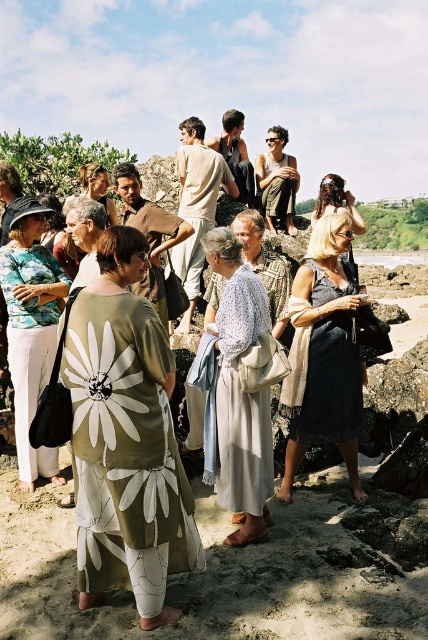
Question: Observing the image, what is the correct spatial positioning of dark gray dress at center in reference to matte brown robe at center?

Choices:
 (A) above
 (B) below

Answer: (B)

Question: Does matte green dress at center come behind blonde hair at center?

Choices:
 (A) no
 (B) yes

Answer: (A)

Question: Which is farther from the green floral dress at center?

Choices:
 (A) matte olive green dress at center
 (B) green floral robe at center
 (C) dark gray dress at center

Answer: (A)

Question: Can you confirm if green floral robe at center is positioned below matte brown robe at center?

Choices:
 (A) no
 (B) yes

Answer: (B)

Question: Which point is closer to the camera taking this photo?

Choices:
 (A) (339, 180)
 (B) (104, 208)
 (C) (249, 196)

Answer: (B)

Question: Which object appears closest to the camera in this image?

Choices:
 (A) light beige cotton robe at center
 (B) green floral dress at center

Answer: (B)